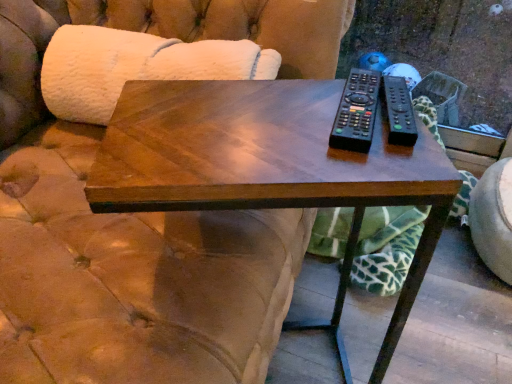
In order to click on free space in front of black plastic remote at upper right, positioned as the second remote in right-to-left order in this screenshot , I will do (359, 162).